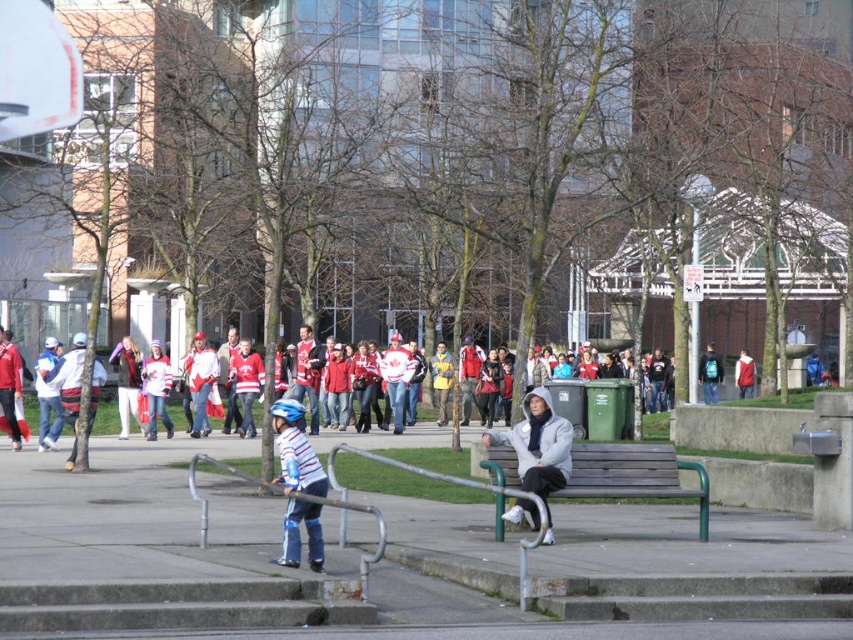
Can you confirm if matte gray hoodie at center is taller than red fabric jacket at center?

Yes, matte gray hoodie at center is taller than red fabric jacket at center.

Between point (560, 435) and point (749, 365), which one is positioned behind?

Positioned behind is point (749, 365).

Where is `matte gray hoodie at center`? The image size is (853, 640). matte gray hoodie at center is located at coordinates (538, 449).

Can you confirm if blue helmet at center is smaller than teal backpack at center-right?

Yes.

Does blue helmet at center appear under teal backpack at center-right?

Indeed, blue helmet at center is positioned under teal backpack at center-right.

The image size is (853, 640). Describe the element at coordinates (294, 451) in the screenshot. I see `blue helmet at center` at that location.

Find the location of a particular element. The height and width of the screenshot is (640, 853). blue helmet at center is located at coordinates (294, 451).

Is matte gray hoodie at center wider than blue helmet at center?

Indeed, matte gray hoodie at center has a greater width compared to blue helmet at center.

Who is shorter, matte gray hoodie at center or blue helmet at center?

Standing shorter between the two is blue helmet at center.

Is point (547, 486) closer to viewer compared to point (312, 540)?

No, (547, 486) is behind (312, 540).

Where is `matte gray hoodie at center`? This screenshot has width=853, height=640. matte gray hoodie at center is located at coordinates (538, 449).